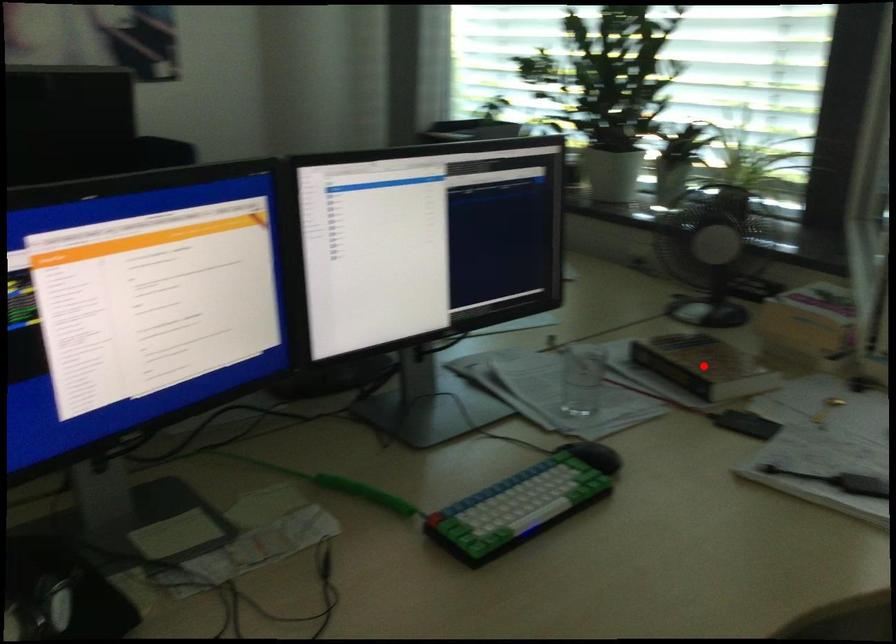
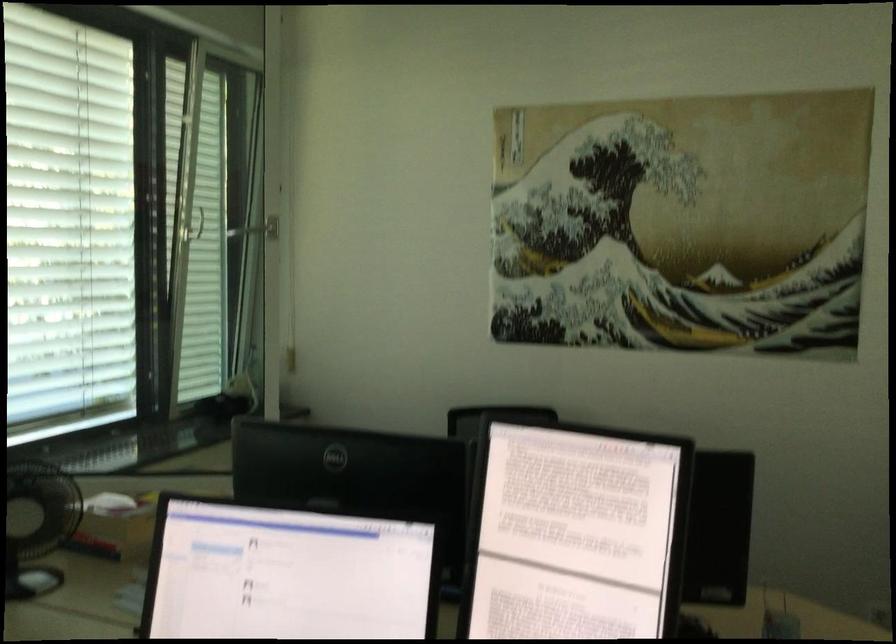
Question: I am providing you with two images of the same scene from different viewpoints. A red point is marked on the first image. At the location where the point appears in image 1, is it still visible in image 2?

Choices:
 (A) Yes
 (B) No

Answer: (B)